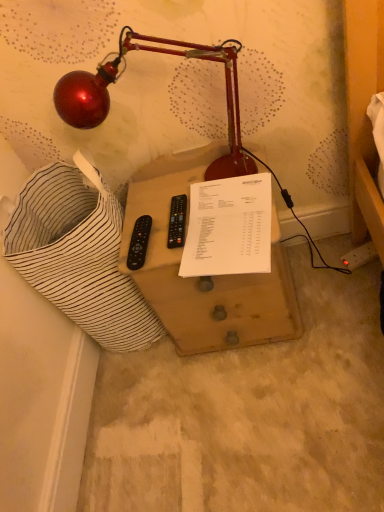
At what (x,y) coordinates should I click in order to perform the action: click on vacant space behind black plastic remote at center, acting as the second control starting from the left. Please return your answer as a coordinate pair (x, y). Looking at the image, I should click on (160, 195).